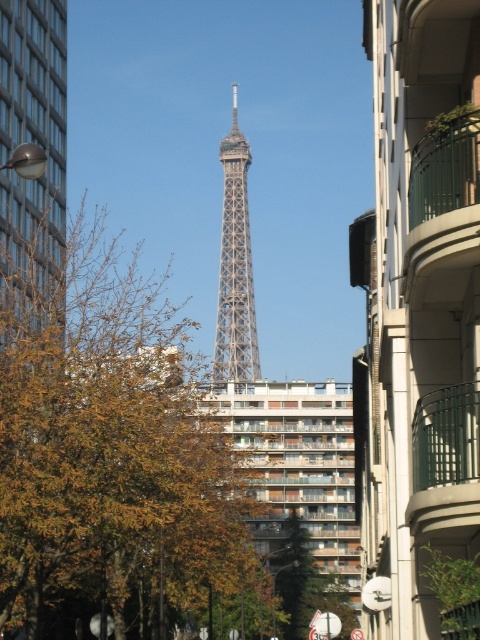
Question: Considering the real-world distances, which object is closest to the brown leafy tree at center?

Choices:
 (A) metallic lattice tower at center
 (B) metallic streetlight at left

Answer: (B)

Question: Can you confirm if brown leafy tree at center is positioned to the left of metallic streetlight at left?

Choices:
 (A) no
 (B) yes

Answer: (A)

Question: Among these points, which one is farthest from the camera?

Choices:
 (A) (233, 323)
 (B) (109, 381)

Answer: (A)

Question: Can you confirm if brown leafy tree at center is thinner than metallic streetlight at left?

Choices:
 (A) yes
 (B) no

Answer: (B)

Question: Which point is closer to the camera?

Choices:
 (A) pos(43,83)
 (B) pos(179,618)
 (C) pos(226,212)

Answer: (B)

Question: Does brown leafy tree at center have a larger size compared to metallic streetlight at left?

Choices:
 (A) no
 (B) yes

Answer: (B)